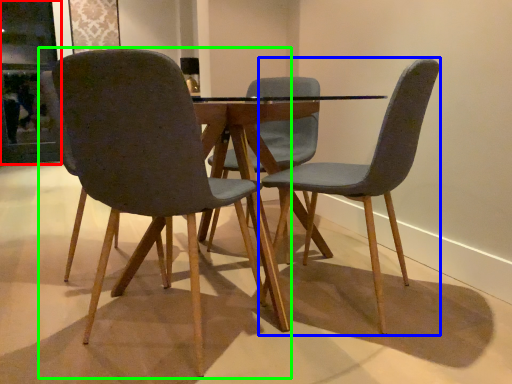
Question: Which object is the farthest from glass door (highlighted by a red box)? Choose among these: chair (highlighted by a blue box) or chair (highlighted by a green box).

Choices:
 (A) chair
 (B) chair

Answer: (A)